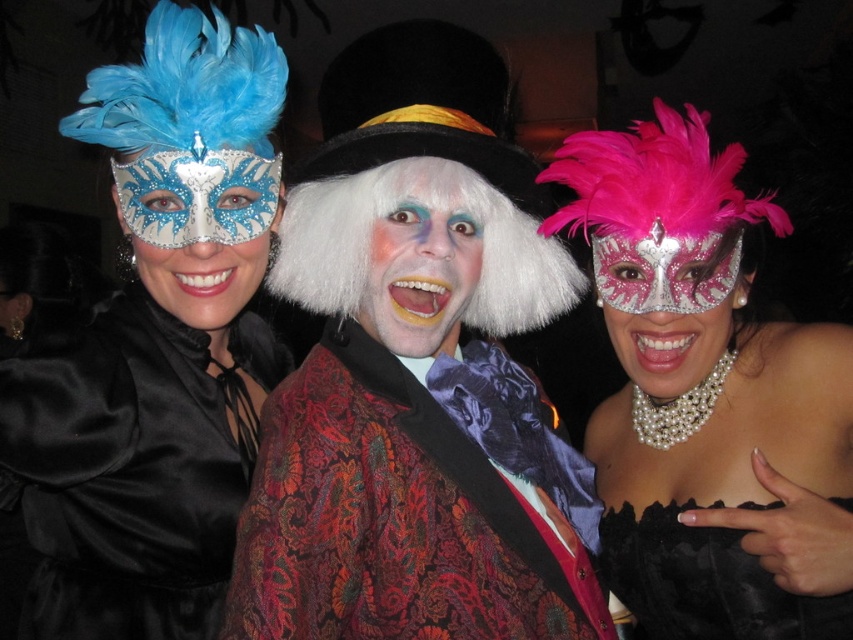
You are taking a photo of the scene and want to ensure both point at position (502, 147) and point at position (676, 557) are in focus. Which point should you focus on to capture both points clearly?

You should focus on point at position (502, 147) because it is closer to the camera, and focusing on the closer point will ensure the farther point at (676, 557) is also in focus due to depth of field.

You are a photographer at the event and need to capture both the matte silver mask at center and the pink glittery mask at center in a single frame. Considering their sizes, which mask should you focus on to ensure both fit comfortably in the photo without cropping?

The matte silver mask at center is wider than the pink glittery mask at center. To ensure both fit comfortably in the photo, focus on framing the matte silver mask at center first, as its larger size will require more space, and adjust the shot to include the smaller pink glittery mask at center without cropping either.

In the scene shown: You are a photographer at the event and want to capture both the shiny velvet coat at center and the pearl necklace at center in a single frame. Which object should you focus on first to ensure both are in the frame?

The shiny velvet coat at center is smaller than the pearl necklace at center, so you should focus on the pearl necklace at center first to ensure both are in the frame.